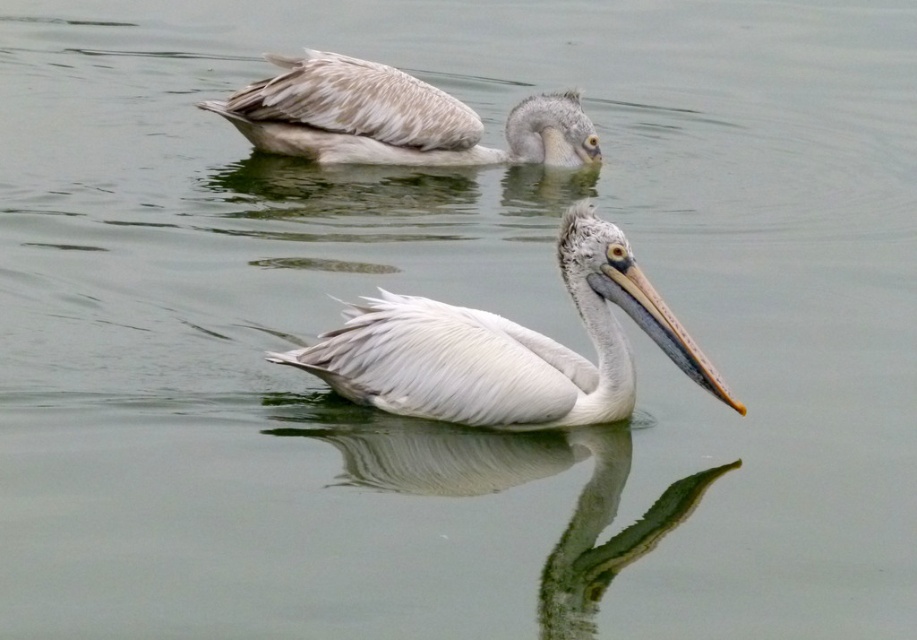
At what (x,y) coordinates should I click in order to perform the action: click on white feathered pelican at center. Please return your answer as a coordinate pair (x, y). The image size is (917, 640). Looking at the image, I should click on (507, 348).

Can you confirm if white feathered pelican at center is taller than grayish-white feathers at upper center?

Correct, white feathered pelican at center is much taller as grayish-white feathers at upper center.

This screenshot has height=640, width=917. I want to click on white feathered pelican at center, so click(507, 348).

Locate an element on the screen. This screenshot has height=640, width=917. white glossy water at lower center is located at coordinates (507, 488).

Is white glossy water at lower center to the right of grayish-white feathers at upper center from the viewer's perspective?

Yes, white glossy water at lower center is to the right of grayish-white feathers at upper center.

The image size is (917, 640). What are the coordinates of `white glossy water at lower center` in the screenshot? It's located at (507, 488).

I want to click on white glossy water at lower center, so click(507, 488).

Between point (457, 317) and point (358, 456), which one is positioned in front?

Point (457, 317) is more forward.

In the scene shown: Is white feathered pelican at center further to the viewer compared to white glossy water at lower center?

Yes.

Is point (387, 385) less distant than point (429, 465)?

Yes, it is in front of point (429, 465).

Identify the location of white feathered pelican at center. (507, 348).